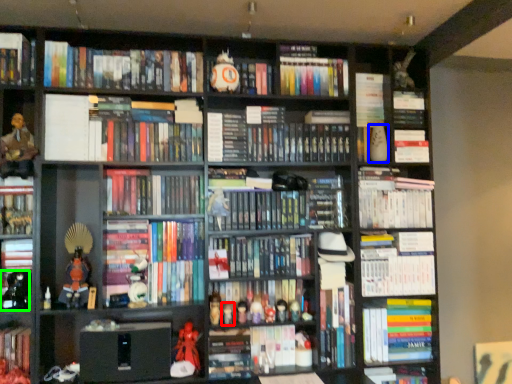
Question: Considering the real-world distances, which object is farthest from toy (highlighted by a red box)? toy (highlighted by a blue box) or toy (highlighted by a green box)?

Choices:
 (A) toy
 (B) toy

Answer: (A)